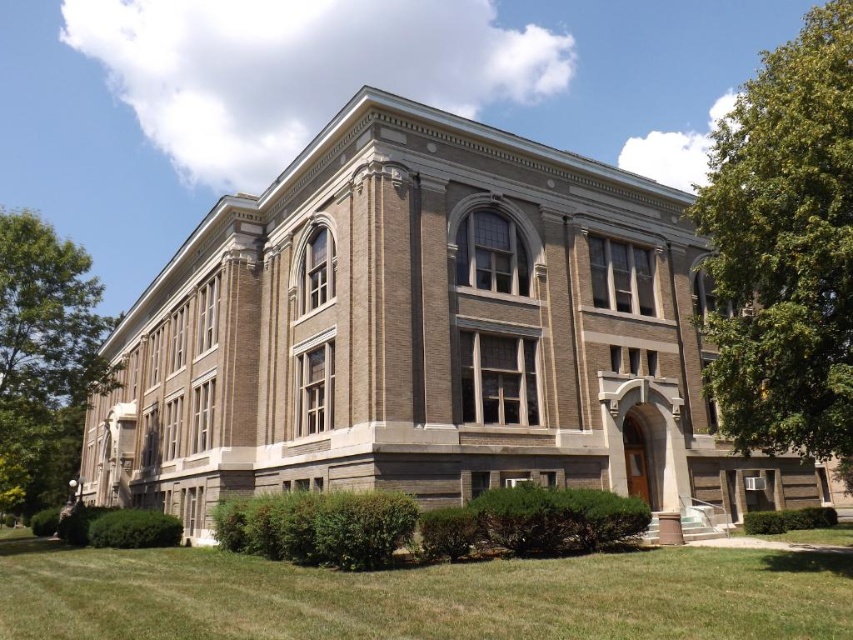
You are standing at the point marked by the coordinates point (422, 596) in the image. Describe what you see around you based on the scene description.

At point (422, 596), you are standing on green grass at lower center. The scene around you includes a large classical building with light brown bricks, symmetrical windows with white stone accents, a prominent entrance archway with columns, and a covered porch with stairs leading up to it.

You are standing in front of the building and want to walk towards the green leafy tree at right. Which direction should you move relative to the green grass at lower center?

You should move to the right relative to the green grass at lower center because the green grass at lower center is positioned on the left side of the green leafy tree at right, meaning the tree is to the right of the grass.

You are a gardener who needs to water the green grass at lower center and the green leafy tree at left. Your watering can holds enough water to cover 20 meters. Can you water both without refilling?

The distance between the green grass at lower center and the green leafy tree at left is 21.89 meters. Since the watering can can only cover 20 meters, you cannot water both without refilling.